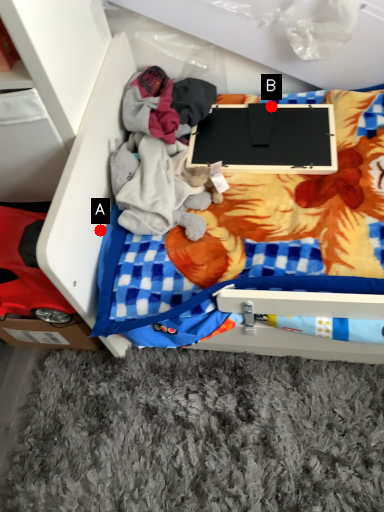
Question: Two points are circled on the image, labeled by A and B beside each circle. Which point is farther to the camera?

Choices:
 (A) A is further
 (B) B is further

Answer: (B)